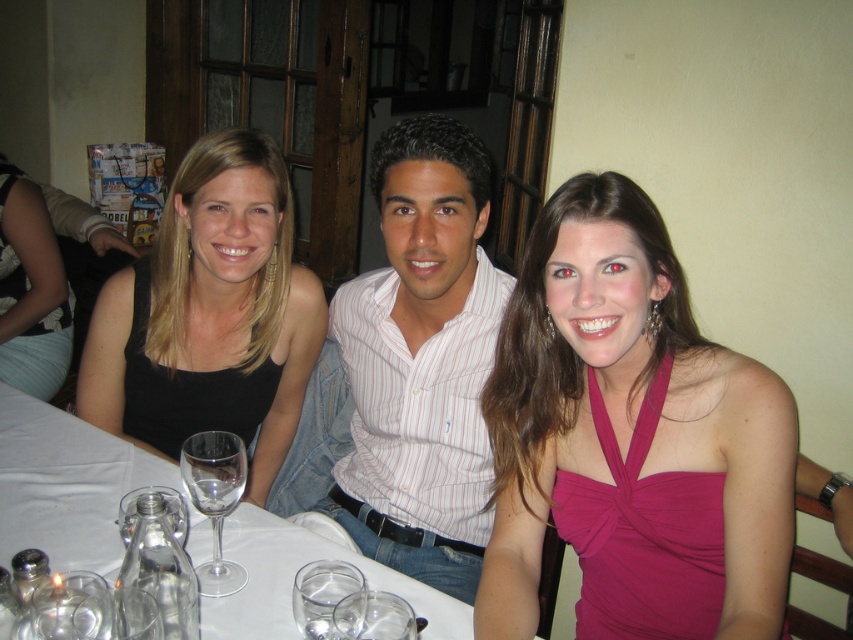
Question: Does pink satin dress at center have a smaller size compared to transparent glass wine glass at lower left?

Choices:
 (A) no
 (B) yes

Answer: (A)

Question: Which point is closer to the camera?

Choices:
 (A) (672, 509)
 (B) (248, 396)

Answer: (A)

Question: Which point is closer to the camera?

Choices:
 (A) black matte dress at left
 (B) white striped shirt at center
 (C) transparent glass wine glass at lower left

Answer: (C)

Question: Can you confirm if white striped shirt at center is thinner than transparent glass wine glass at lower left?

Choices:
 (A) no
 (B) yes

Answer: (A)

Question: Is pink satin dress at center positioned before black matte dress at left?

Choices:
 (A) no
 (B) yes

Answer: (B)

Question: Which point is closer to the camera?

Choices:
 (A) (335, 628)
 (B) (103, 540)
 (C) (312, 580)
 (D) (560, 221)

Answer: (A)